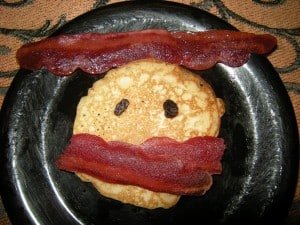
Locate an element on the screen. plate is located at coordinates (36, 121).